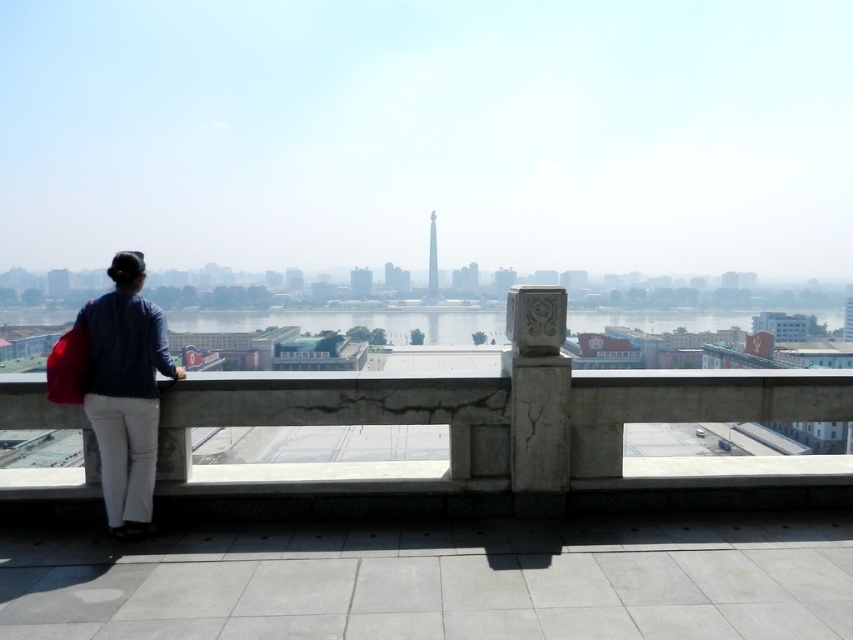
You are a drone operator trying to land a drone on a specific location. The drone is currently above the city skyline. You need to land it on the concrete marked by point (498, 412). However, there is a person standing on a stone railing in the foreground. Is the concrete at left near the person?

The point (498, 412) marks concrete at left, so yes, the concrete at left is near the person standing on the stone railing in the foreground.

In the scene shown: You are a photographer trying to capture a shot of the city skyline. You notice the concrete at left and the denim jacket at left in your frame. Which object is closer to the camera?

The denim jacket at left is closer to the camera because it is taller than the concrete at left in the image.